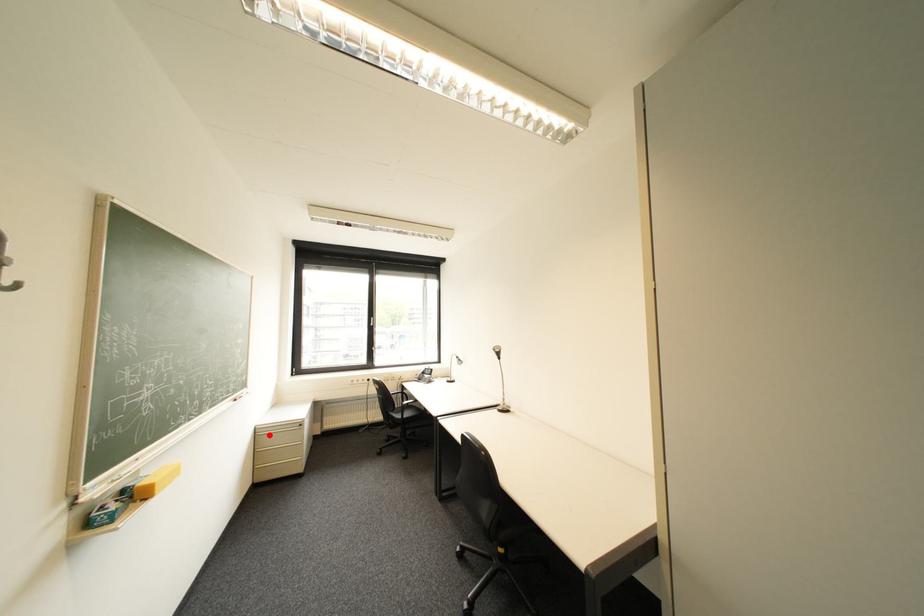
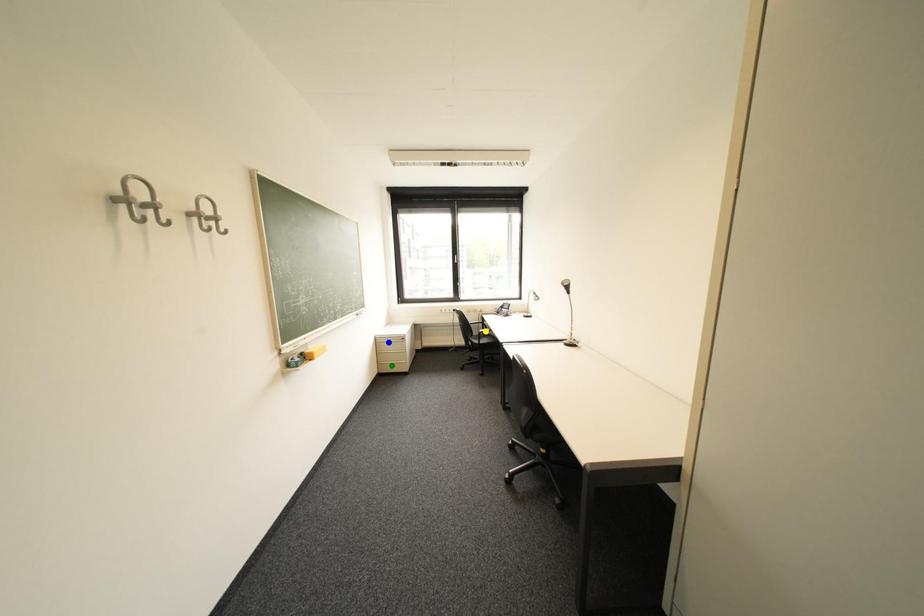
Question: I am providing you with two images of the same scene from different viewpoints. A red point is marked on the first image. You are given multiple points on the second image. In image 2, which mark is for the same physical point as the one in image 1?

Choices:
 (A) blue point
 (B) green point
 (C) yellow point

Answer: (A)